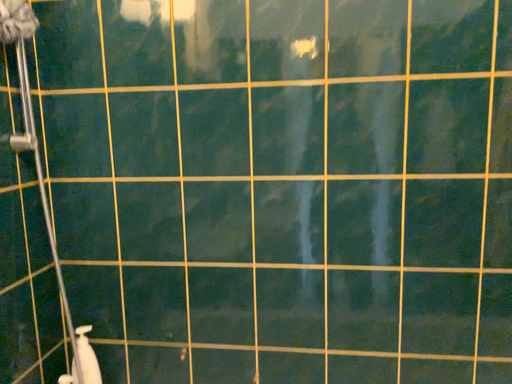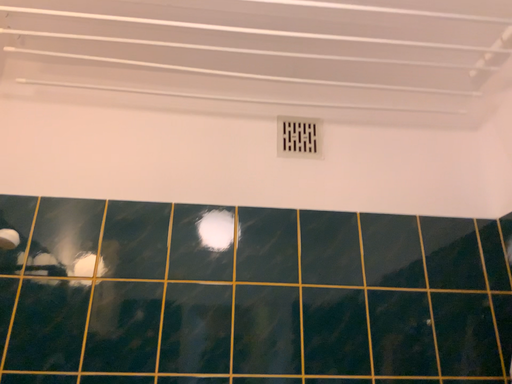
Question: How did the camera likely rotate when shooting the video?

Choices:
 (A) rotated left
 (B) rotated right

Answer: (B)